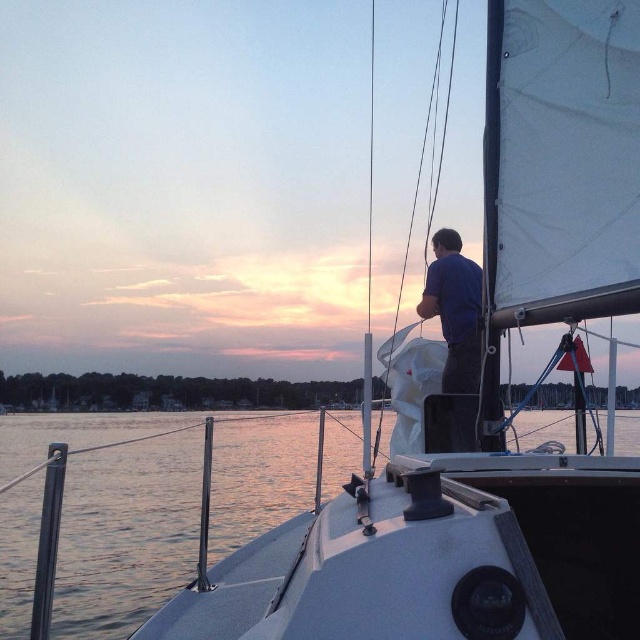
Question: Among these objects, which one is nearest to the camera?

Choices:
 (A) dark blue shirt at upper center
 (B) clear water at lower left

Answer: (B)

Question: Is clear water at lower left bigger than dark blue shirt at upper center?

Choices:
 (A) no
 (B) yes

Answer: (B)

Question: Which of the following is the farthest from the observer?

Choices:
 (A) (449, 266)
 (B) (124, 611)

Answer: (B)

Question: Is clear water at lower left smaller than dark blue shirt at upper center?

Choices:
 (A) no
 (B) yes

Answer: (A)

Question: Among these points, which one is nearest to the camera?

Choices:
 (A) (452, 332)
 (B) (195, 518)

Answer: (A)

Question: Is clear water at lower left above dark blue shirt at upper center?

Choices:
 (A) no
 (B) yes

Answer: (A)